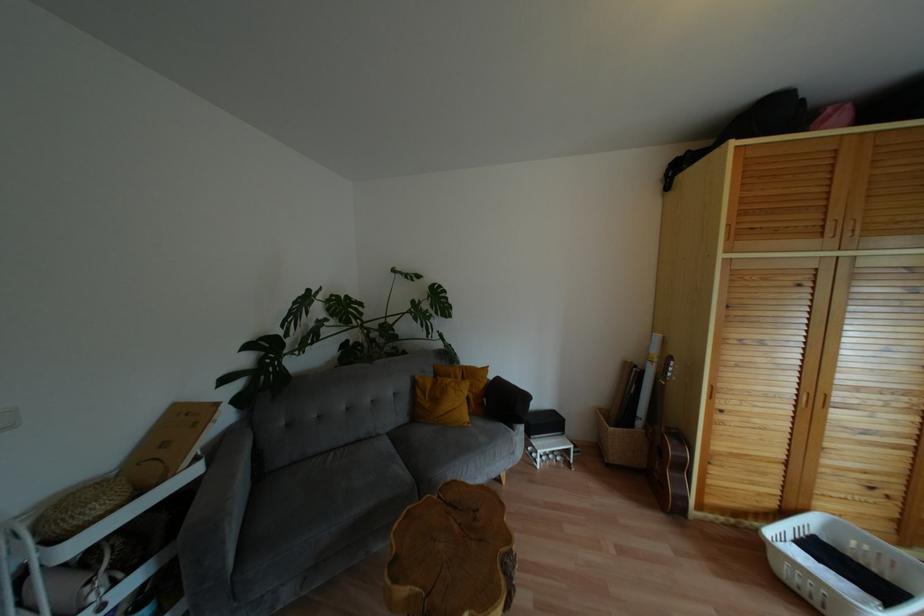
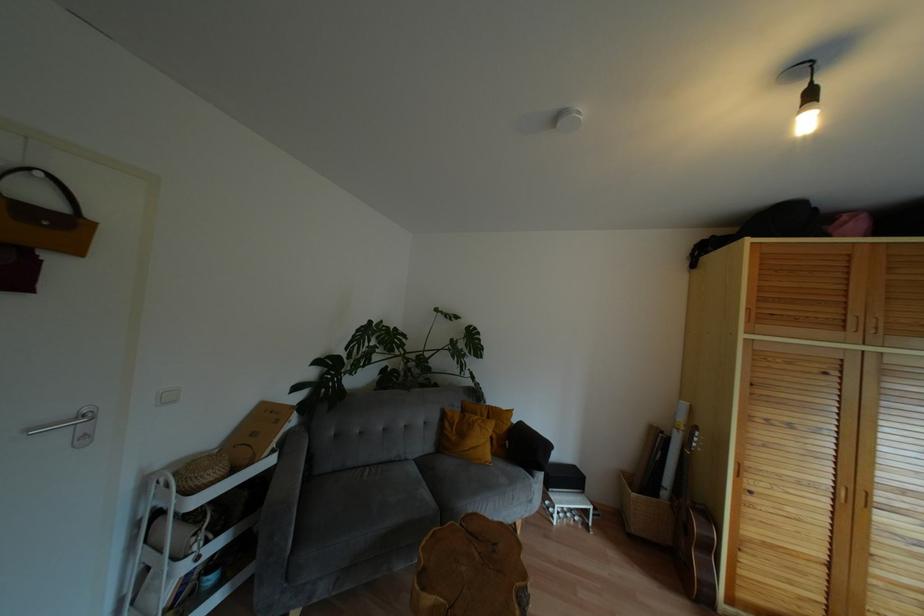
Where in the second image is the point corresponding to (484,369) from the first image?

(508, 411)